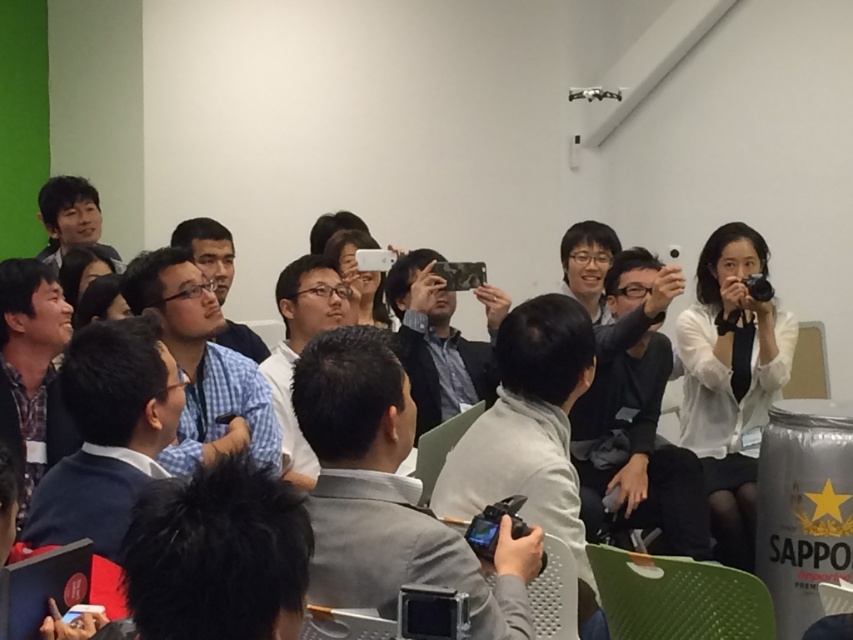
Is point (322, 588) less distant than point (100, 550)?

Yes, point (322, 588) is in front of point (100, 550).

Who is shorter, gray fabric shirt at center or matte black camera at center?

gray fabric shirt at center

You are a GUI agent. You are given a task and a screenshot of the screen. Output one action in this format:
    pyautogui.click(x=<x>, y=<y>)
    Task: Click on the gray fabric shirt at center
    The height and width of the screenshot is (640, 853).
    Given the screenshot: What is the action you would take?
    pyautogui.click(x=387, y=493)

Identify the location of gray fabric shirt at center. The width and height of the screenshot is (853, 640). (387, 493).